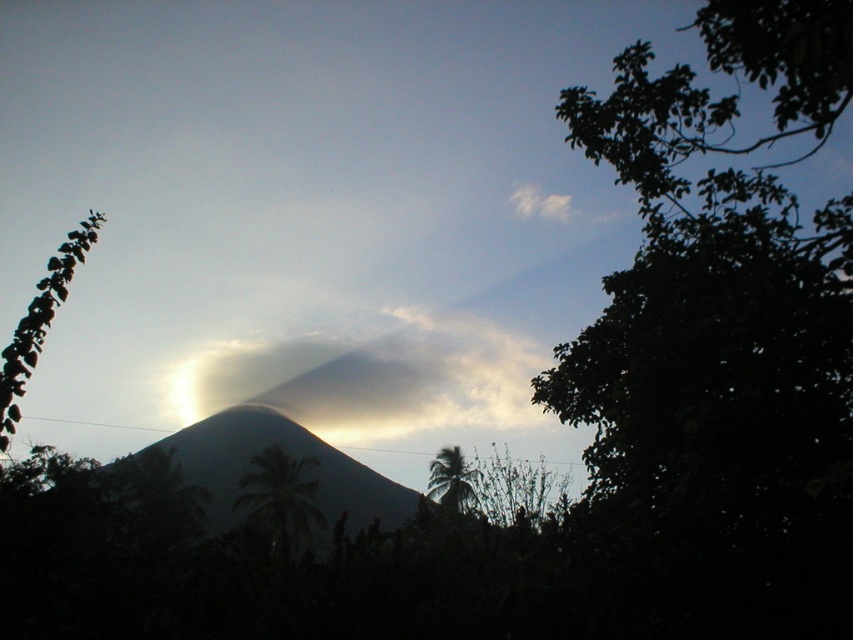
You are a photographer who wants to capture the smokey gray cloud at center in your photo. Based on the scene description, where should you position your camera to ensure the cloud is centered in the frame?

The smokey gray cloud at center is already positioned at the center of the image at coordinates point (x=392, y=380). To keep it centered, the photographer should ensure the camera is aligned so the cloud remains at this central point.

You are standing at the point marked by the coordinates point [289,454] in the image. What object are you standing on?

You are standing on the dull gray rock at center marked by the coordinates point [289,454].